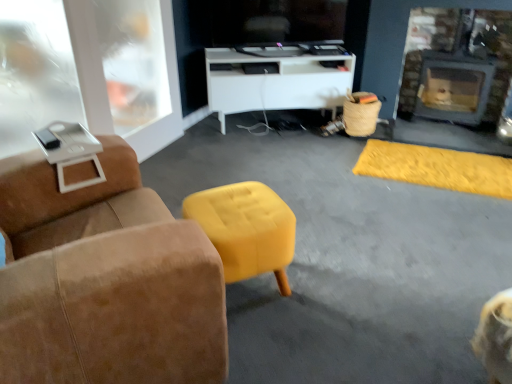
Question: Would you say suede armchair at left is inside or outside yellow fabric stool at center?

Choices:
 (A) outside
 (B) inside

Answer: (A)

Question: Is suede armchair at left wider or thinner than yellow fabric stool at center?

Choices:
 (A) wide
 (B) thin

Answer: (A)

Question: Which object is the closest to the transparent plastic glass door at upper left?

Choices:
 (A) yellow fabric ottoman at center
 (B) brick fireplace at right
 (C) white glossy cabinet at center
 (D) suede armchair at left
 (E) yellow fabric stool at center

Answer: (E)

Question: Considering the real-world distances, which object is farthest from the suede armchair at left?

Choices:
 (A) transparent plastic glass door at upper left
 (B) yellow fabric ottoman at center
 (C) brick fireplace at right
 (D) yellow fabric stool at center
 (E) white glossy cabinet at center

Answer: (C)